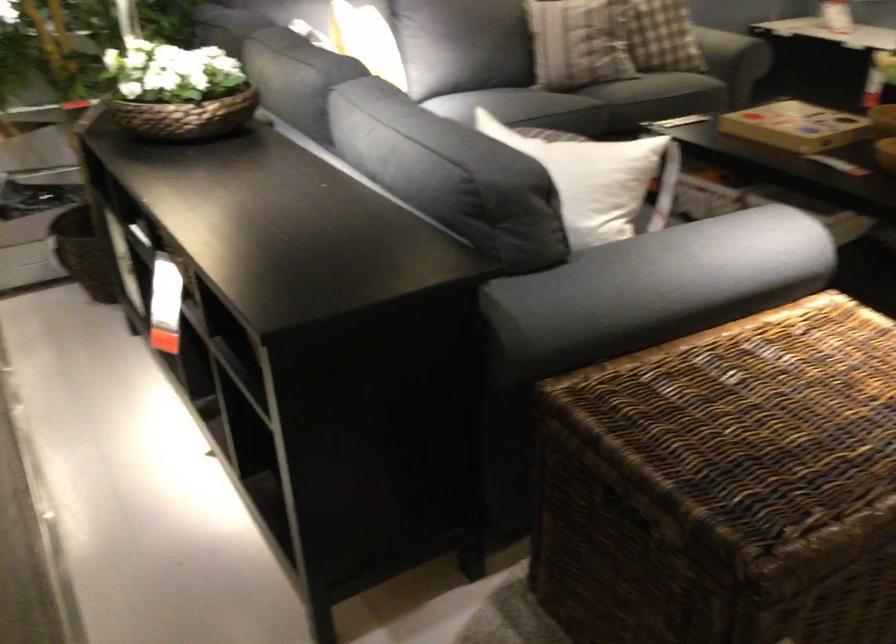
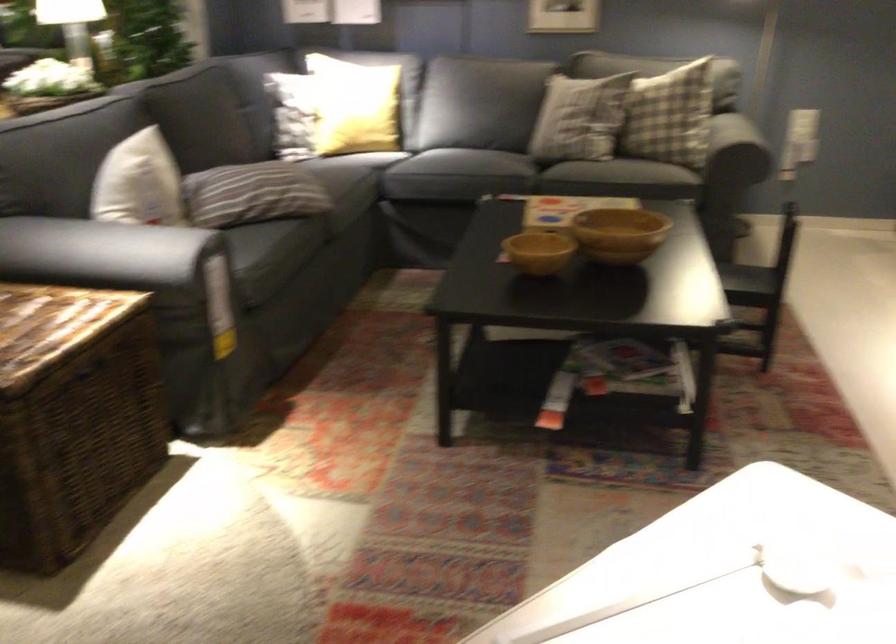
In the second image, find the point that corresponds to point (463, 111) in the first image.

(386, 149)